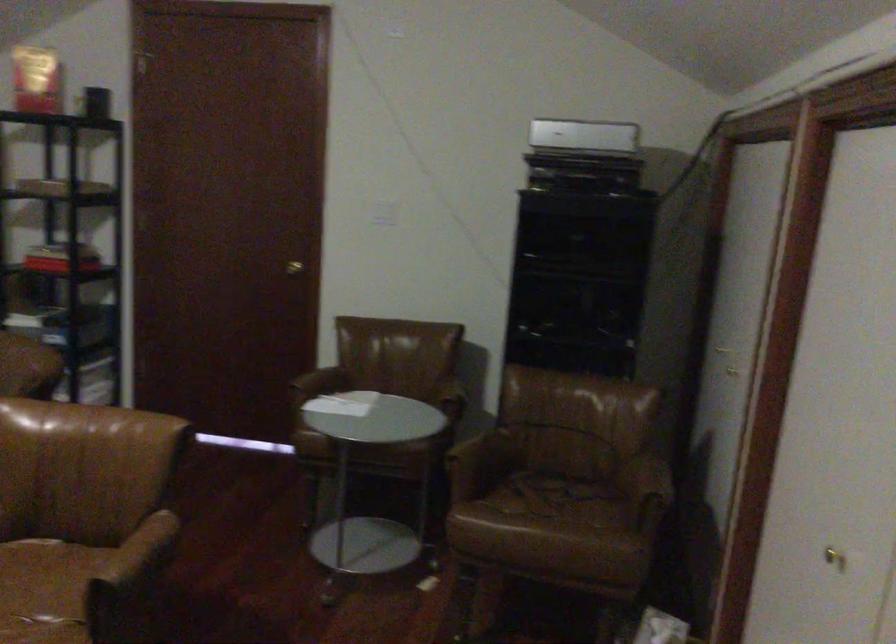
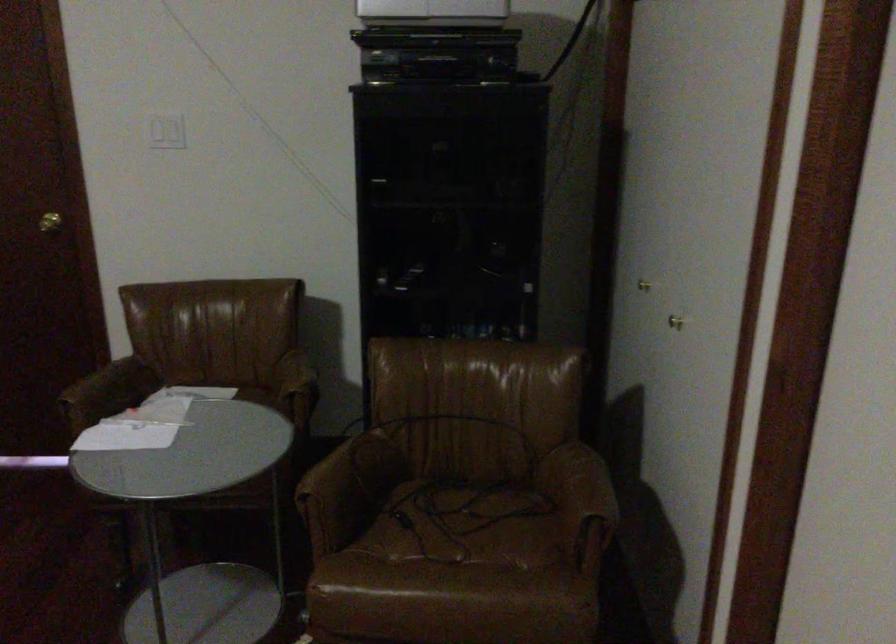
In the second image, find the point that corresponds to the point at 291,265 in the first image.

(49, 222)